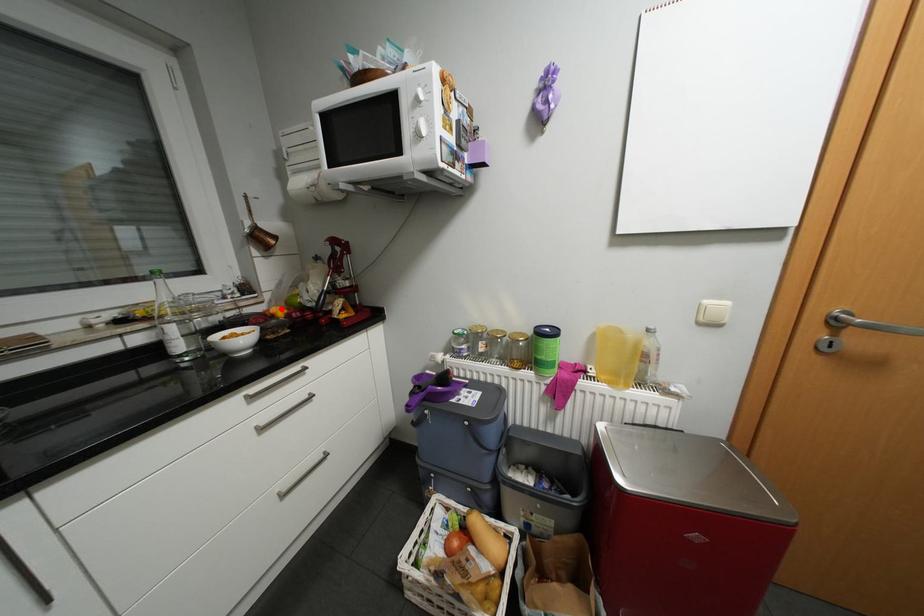
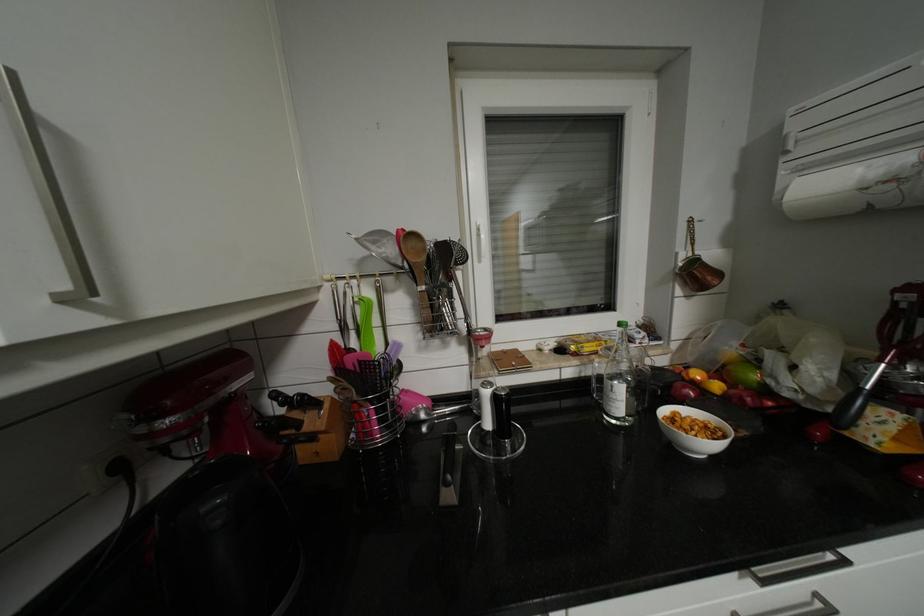
The point at the highlighted location is marked in the first image. Where is the corresponding point in the second image?

(704, 374)